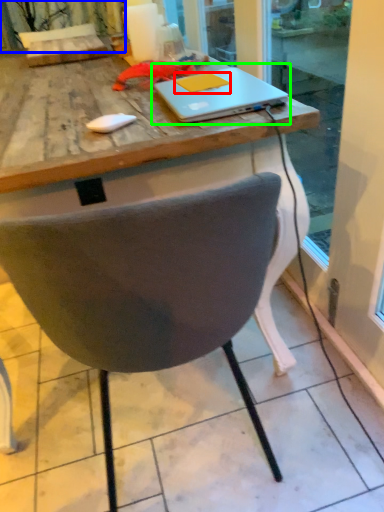
Question: Which is nearer to the notepad (highlighted by a red box)? curtain (highlighted by a blue box) or laptop (highlighted by a green box).

Choices:
 (A) curtain
 (B) laptop

Answer: (B)